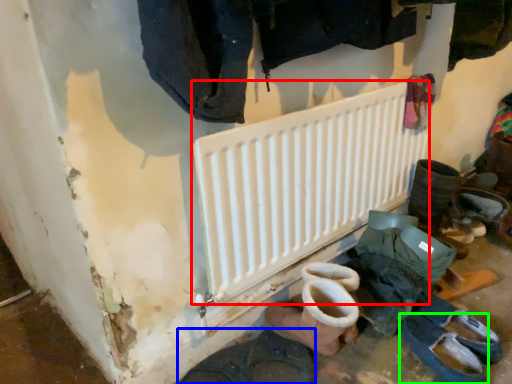
Question: Which is nearer to the radiator (highlighted by a red box)? footwear (highlighted by a blue box) or footwear (highlighted by a green box).

Choices:
 (A) footwear
 (B) footwear

Answer: (A)